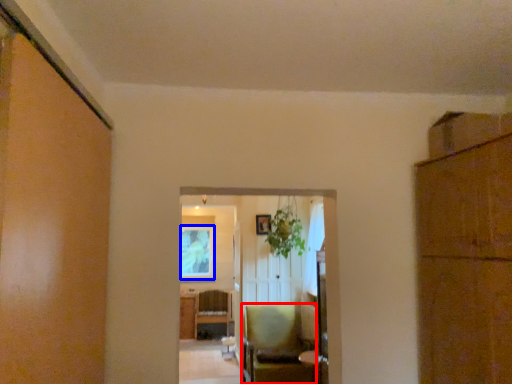
Question: Which object appears closest to the camera in this image, chair (highlighted by a red box) or window screen (highlighted by a blue box)?

Choices:
 (A) chair
 (B) window screen

Answer: (A)